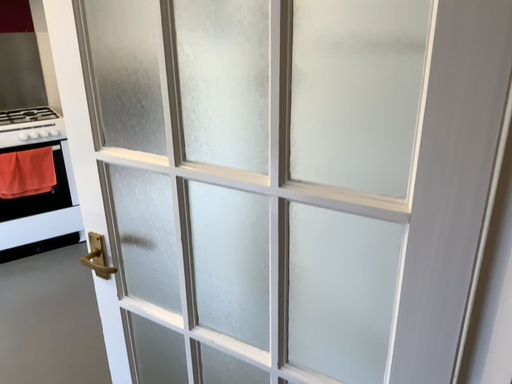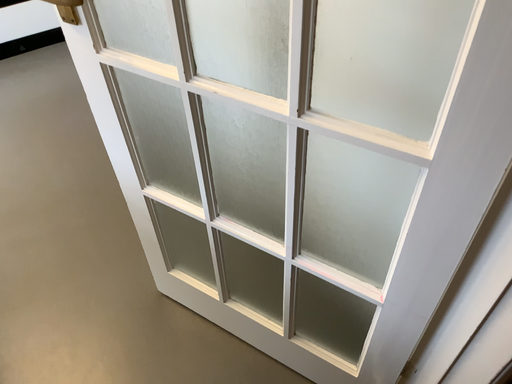
Question: Which way did the camera rotate in the video?

Choices:
 (A) rotated downward
 (B) rotated upward

Answer: (A)